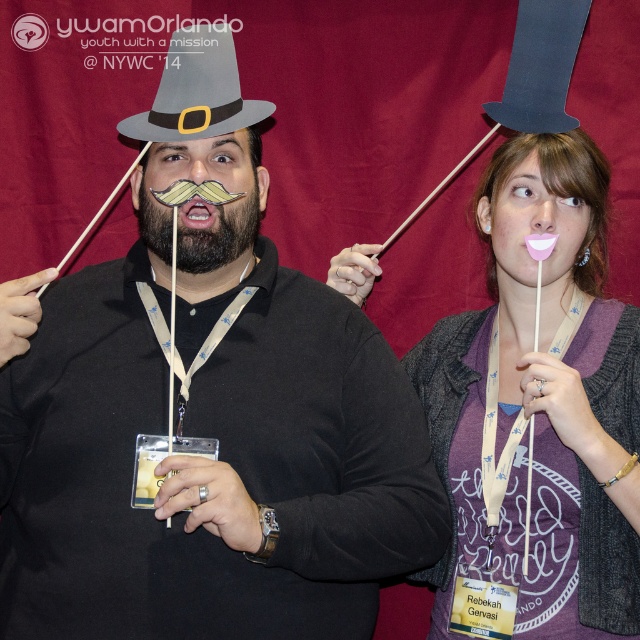
Which of these two, matte gray hat at center or brownwoodybeard at center, stands shorter?

With less height is brownwoodybeard at center.

Can you confirm if matte gray hat at center is wider than brownwoodybeard at center?

Yes.

Identify the location of matte gray hat at center. The image size is (640, 640). (209, 460).

Identify the location of matte gray hat at center. (209, 460).

In the scene shown: Is purple matte shirt at center wider than brownwoodybeard at center?

Indeed, purple matte shirt at center has a greater width compared to brownwoodybeard at center.

Is purple matte shirt at center bigger than brownwoodybeard at center?

Yes.

Find the location of a particular element. This screenshot has height=640, width=640. purple matte shirt at center is located at coordinates (541, 404).

This screenshot has height=640, width=640. Find the location of `purple matte shirt at center`. purple matte shirt at center is located at coordinates (541, 404).

Does matte gray hat at center have a greater width compared to gray felt hat at upper center?

Yes.

At what (x,y) coordinates should I click in order to perform the action: click on matte gray hat at center. Please return your answer as a coordinate pair (x, y). Looking at the image, I should click on (209, 460).

You are a GUI agent. You are given a task and a screenshot of the screen. Output one action in this format:
    pyautogui.click(x=<x>, y=<y>)
    Task: Click on the matte gray hat at center
    Image resolution: width=640 pixels, height=640 pixels.
    Given the screenshot: What is the action you would take?
    pyautogui.click(x=209, y=460)